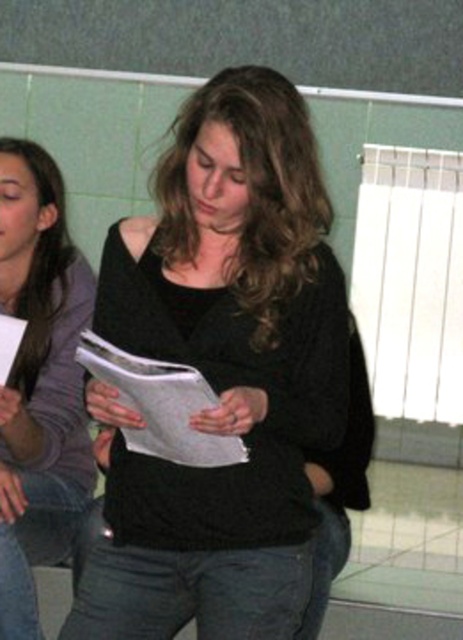
You are a robot with a 5.5 inch wide arm. You need to pick up the white paper at center. Is your arm narrow enough to reach it without hitting the black matte sweater at center?

The distance between the black matte sweater at center and the white paper at center is 5.70 inches. Since your arm is 5.5 inches wide, it is narrow enough to fit within the space between them, so yes, you can reach the white paper at center without hitting the black matte sweater at center.

You are standing in a room and see a point marked at coordinates (317, 182). You need to place a 1.5 meter tall bookshelf on the floor. Can you safely place it so that the bookshelf does not come closer than 1.5 meters from that point?

The point at coordinates (317, 182) is 1.66 meters from the camera. Since the bookshelf is 1.5 meters tall, it can be placed 1.5 meters away from the point, maintaining the required distance. The distance between the camera and the point allows for this placement.

You are organizing a clothing donation drive and need to sort items by size. You have two sweaters in front of you labeled as the black matte sweater at center and the matte black sweater at center. Which one should you place in the small size bin?

The black matte sweater at center has a smaller size compared to the matte black sweater at center, so it should be placed in the small size bin.